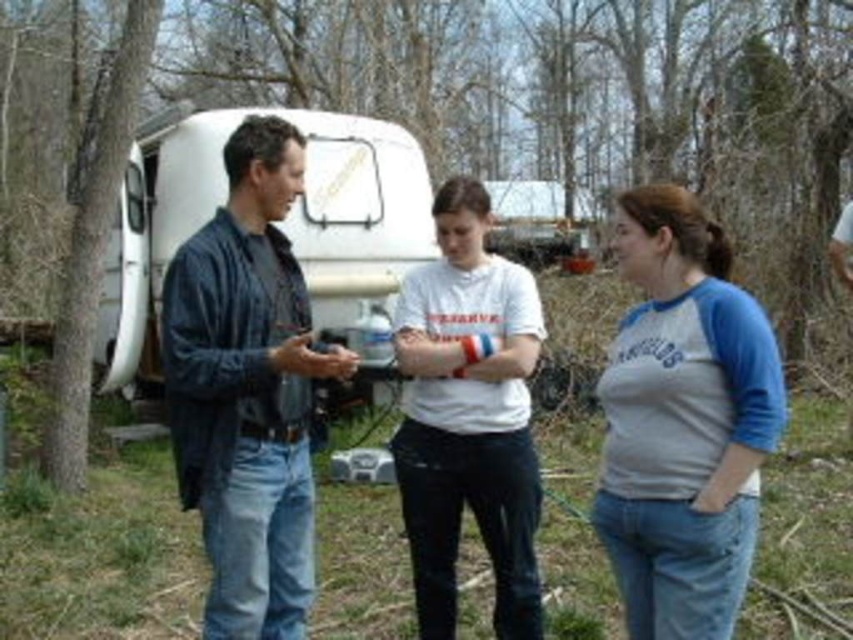
Based on the scene description, can you determine the spatial relationship between the gray cotton shirt at center and the white matte recreational vehicle at center?

The gray cotton shirt at center is to the right of the white matte recreational vehicle at center.